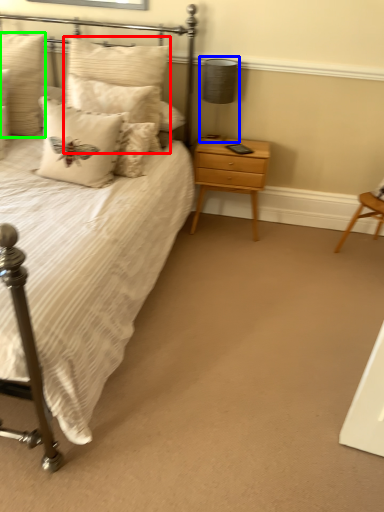
Question: Which object is the farthest from pillow (highlighted by a red box)? Choose among these: table lamp (highlighted by a blue box) or pillow (highlighted by a green box).

Choices:
 (A) table lamp
 (B) pillow

Answer: (A)